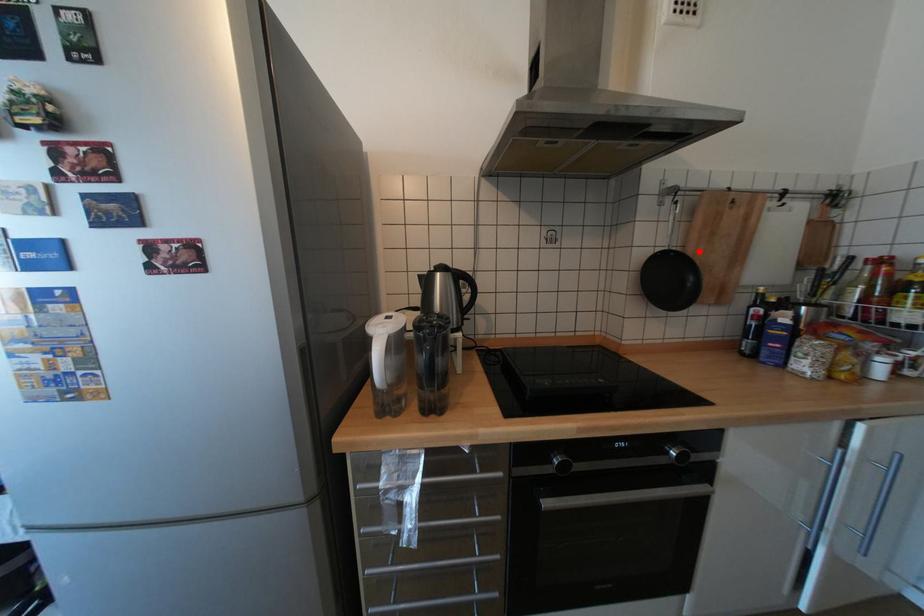
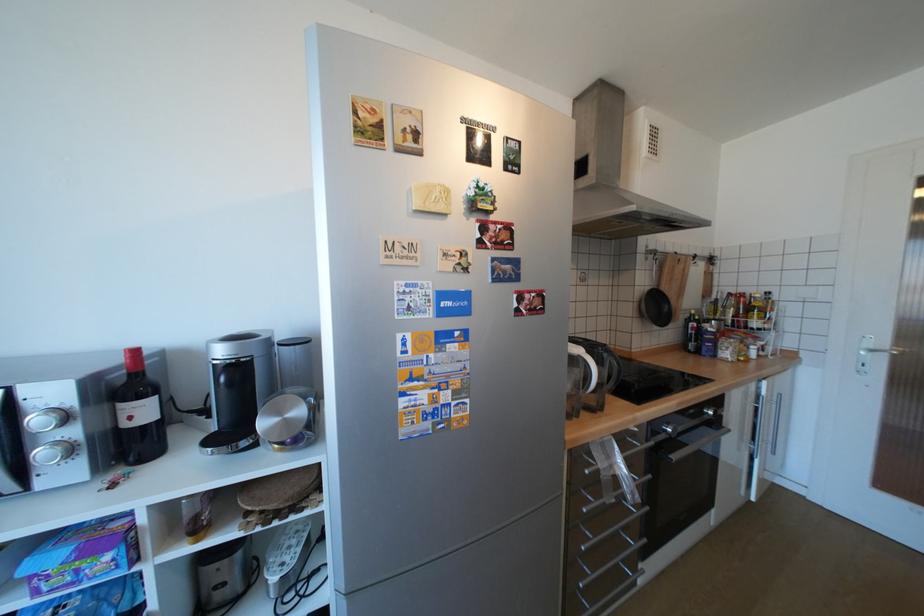
Where in the second image is the point corresponding to the highlighted location from the first image?

(672, 290)